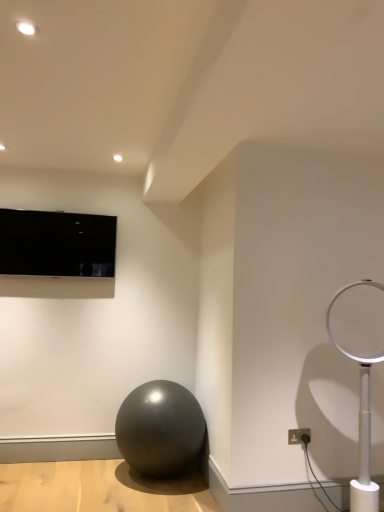
Question: Is white plastic lamp at right surrounded by shiny black ball at center?

Choices:
 (A) yes
 (B) no

Answer: (B)

Question: From the image's perspective, is shiny black ball at center beneath white plastic lamp at right?

Choices:
 (A) yes
 (B) no

Answer: (A)

Question: Does shiny black ball at center have a lesser width compared to white plastic lamp at right?

Choices:
 (A) no
 (B) yes

Answer: (A)

Question: Is the position of shiny black ball at center more distant than that of white plastic lamp at right?

Choices:
 (A) no
 (B) yes

Answer: (B)

Question: Considering the relative sizes of shiny black ball at center and white plastic lamp at right in the image provided, is shiny black ball at center shorter than white plastic lamp at right?

Choices:
 (A) no
 (B) yes

Answer: (B)

Question: From the image's perspective, is shiny black ball at center on white plastic lamp at right?

Choices:
 (A) yes
 (B) no

Answer: (B)

Question: Is white plastic lamp at right far away from white plastic electric outlet at lower right?

Choices:
 (A) yes
 (B) no

Answer: (B)

Question: From a real-world perspective, is white plastic lamp at right over white plastic electric outlet at lower right?

Choices:
 (A) yes
 (B) no

Answer: (A)

Question: Can you confirm if white plastic lamp at right is shorter than white plastic electric outlet at lower right?

Choices:
 (A) no
 (B) yes

Answer: (A)

Question: Considering the relative positions of white plastic lamp at right and white plastic electric outlet at lower right in the image provided, is white plastic lamp at right to the left of white plastic electric outlet at lower right from the viewer's perspective?

Choices:
 (A) no
 (B) yes

Answer: (A)

Question: Could you tell me if white plastic lamp at right is facing white plastic electric outlet at lower right?

Choices:
 (A) no
 (B) yes

Answer: (A)

Question: Is white plastic lamp at right wider than white plastic electric outlet at lower right?

Choices:
 (A) no
 (B) yes

Answer: (B)

Question: Is white plastic electric outlet at lower right turned away from matte black tv at upper left?

Choices:
 (A) no
 (B) yes

Answer: (A)